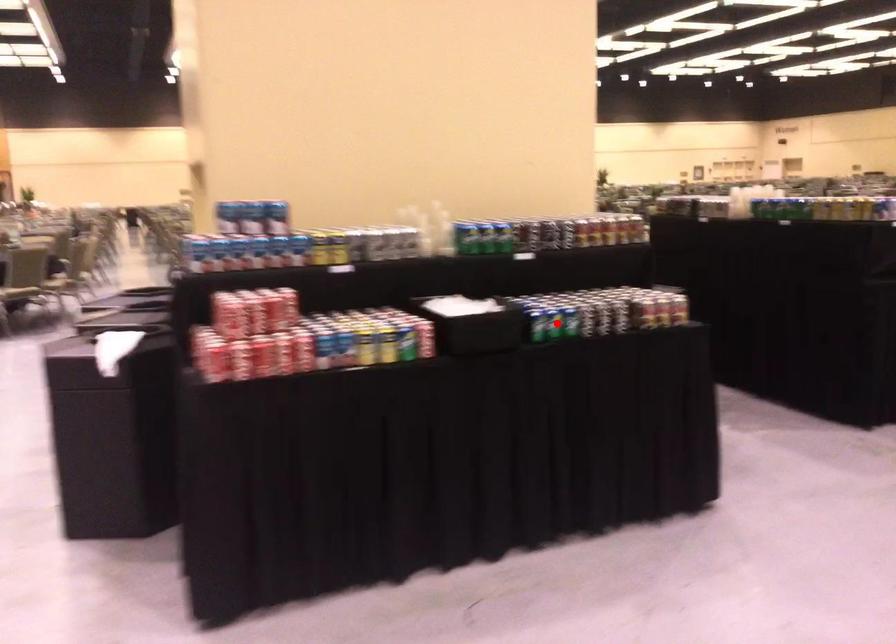
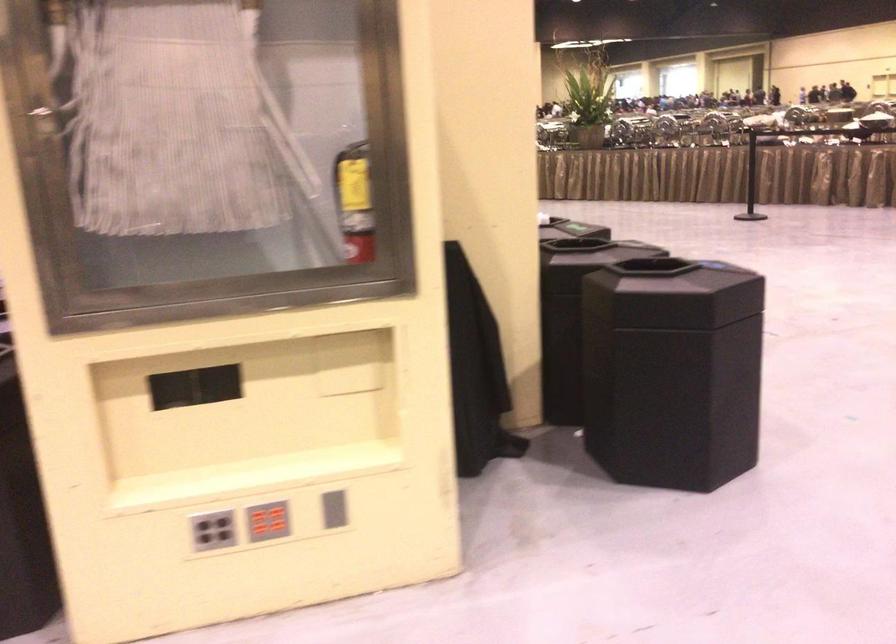
Question: I am providing you with two images of the same scene from different viewpoints. A red point is marked on the first image. Is the red point's position out of view in image 2?

Choices:
 (A) Yes
 (B) No

Answer: (A)